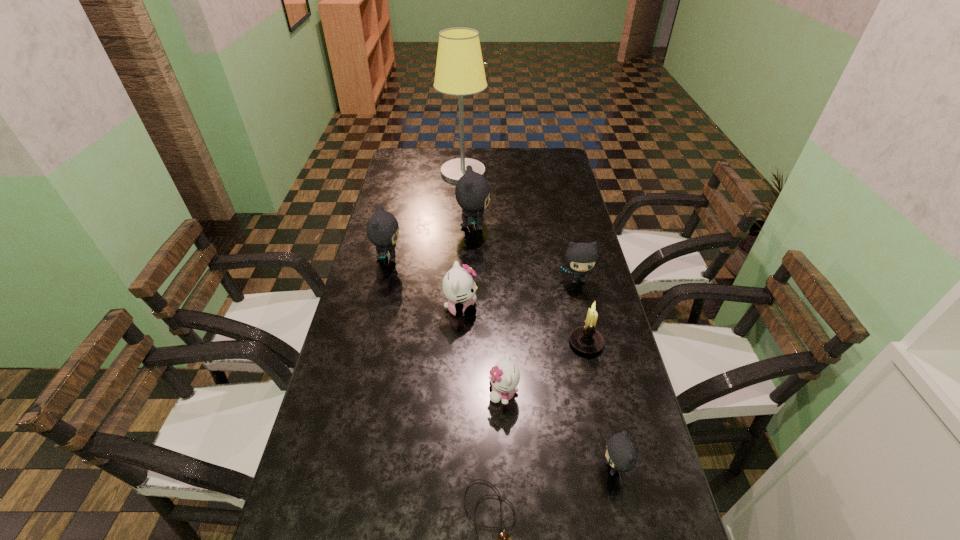
Where is `the third biggest gray kitten`? The height and width of the screenshot is (540, 960). the third biggest gray kitten is located at coordinates (580, 257).

The width and height of the screenshot is (960, 540). I want to click on the nearer white kitten, so click(504, 377).

I want to click on the right white kitten, so click(504, 377).

Identify the location of the smallest gray kitten. The height and width of the screenshot is (540, 960). [621, 454].

You are a GUI agent. You are given a task and a screenshot of the screen. Output one action in this format:
    pyautogui.click(x=<x>, y=<y>)
    Task: Click on the nearest kitten
    This screenshot has height=540, width=960.
    Given the screenshot: What is the action you would take?
    pyautogui.click(x=621, y=454)

Identify the location of free space located 0.300m on the right of the farthest object. (556, 172).

The width and height of the screenshot is (960, 540). In order to click on vacant space located 0.340m on the front-facing side of the third gray kitten from right to left in this screenshot , I will do `click(582, 226)`.

What are the coordinates of `vacant space located 0.270m on the front-facing side of the leftmost kitten` in the screenshot? It's located at (483, 258).

What are the coordinates of `blank area located on the front-facing side of the bigger white kitten` in the screenshot? It's located at (527, 309).

Locate an element on the screen. The width and height of the screenshot is (960, 540). free space located 0.350m on the left of the candle holder is located at coordinates [444, 342].